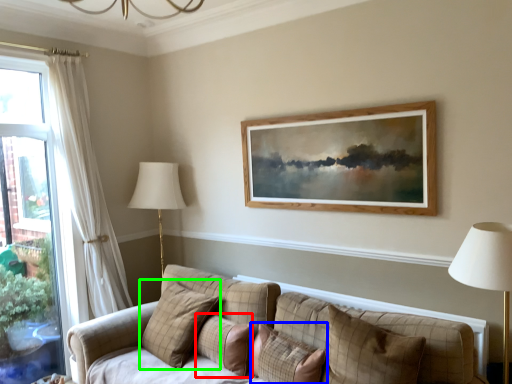
Question: Which object is positioned closest to pillow (highlighted by a red box)? Select from pillow (highlighted by a blue box) and pillow (highlighted by a green box).

Choices:
 (A) pillow
 (B) pillow

Answer: (A)